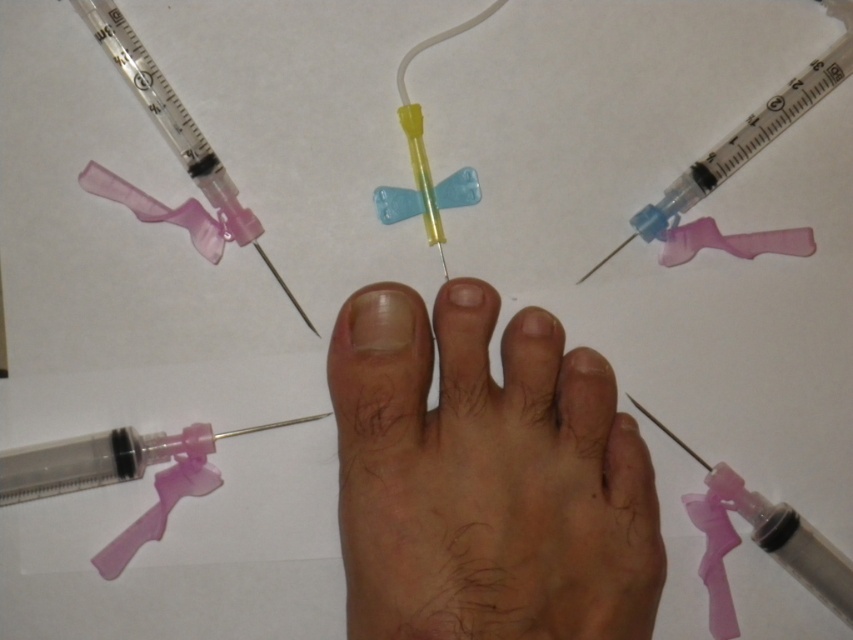
You are a nurse preparing to administer an injection to the foot shown in the image. You need to locate the pale skin nail at center before proceeding. Based on the syringes around it, where would you look relative to the pink translucent syringe at upper left?

The pink translucent syringe at upper left is above the pale skin nail at center, so you should look below the pink translucent syringe at upper left to find the pale skin nail at center.

You are a medical professional examining the foot image. You need to determine the order of the syringes from closest to farthest from the viewer. Which syringe is closer to you, the one at point [204,188] or the one at point [379,314]?

Point [379,314] is closer to the viewer than point [204,188] because the Objects Description states that point [204,188] is behind point [379,314].